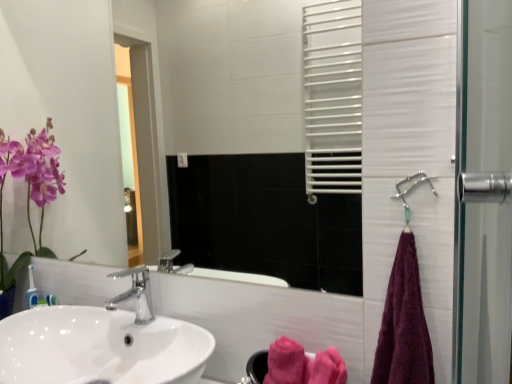
Describe the element at coordinates (247, 147) in the screenshot. The image size is (512, 384). I see `white glossy mirror at upper center` at that location.

The width and height of the screenshot is (512, 384). What are the coordinates of `purple cotton towel at right, which appears as the first bath towel when viewed from the right` in the screenshot? It's located at (404, 324).

Locate an element on the screen. polished chrome faucet at center is located at coordinates (135, 294).

Considering the points (225, 219) and (141, 367), which point is in front, point (225, 219) or point (141, 367)?

The point (141, 367) is more forward.

From the image's perspective, does white glossy mirror at upper center appear lower than white glossy sink at lower left?

No, from the image's perspective, white glossy mirror at upper center is not beneath white glossy sink at lower left.

Could white glossy sink at lower left be considered to be inside white glossy mirror at upper center?

No, white glossy sink at lower left is not surrounded by white glossy mirror at upper center.

In terms of size, does white glossy mirror at upper center appear bigger or smaller than white glossy sink at lower left?

white glossy mirror at upper center is smaller than white glossy sink at lower left.

Considering the sizes of white glossy sink at lower left and white glossy mirror at upper center in the image, is white glossy sink at lower left wider or thinner than white glossy mirror at upper center?

In the image, white glossy sink at lower left appears to be wider than white glossy mirror at upper center.

Is white glossy sink at lower left facing towards white glossy mirror at upper center?

No, white glossy sink at lower left is not turned towards white glossy mirror at upper center.

Considering the relative positions of white glossy sink at lower left and white glossy mirror at upper center in the image provided, is white glossy sink at lower left behind white glossy mirror at upper center?

No, it is in front of white glossy mirror at upper center.

Is pink fluffy bath towel at lower center, which is the first bath towel in left-to-right order, facing away from white glossy sink at lower left?

No.

Who is smaller, pink fluffy bath towel at lower center, which is the first bath towel in left-to-right order, or white glossy sink at lower left?

pink fluffy bath towel at lower center, which is the first bath towel in left-to-right order, is smaller.

Could you measure the distance between pink fluffy bath towel at lower center, the 1th bath towel when ordered from back to front, and white glossy sink at lower left?

A distance of 17.06 inches exists between pink fluffy bath towel at lower center, the 1th bath towel when ordered from back to front, and white glossy sink at lower left.

I want to click on sink that is on the left side of pink fluffy bath towel at lower center, positioned as the second bath towel in right-to-left order, so click(100, 346).

In the image, is white glossy sink at lower left positioned in front of or behind pink fluffy bath towel at lower center, positioned as the 2th bath towel in front-to-back order?

Visually, white glossy sink at lower left is located in front of pink fluffy bath towel at lower center, positioned as the 2th bath towel in front-to-back order.

Between white glossy sink at lower left and pink fluffy bath towel at lower center, positioned as the second bath towel in right-to-left order, which one has smaller width?

With smaller width is pink fluffy bath towel at lower center, positioned as the second bath towel in right-to-left order.

Which is nearer, (42, 349) or (269, 377)?

Clearly, point (42, 349) is more distant from the camera than point (269, 377).

Is white glossy sink at lower left at the left side of polished chrome faucet at center?

Yes, white glossy sink at lower left is to the left of polished chrome faucet at center.

The height and width of the screenshot is (384, 512). I want to click on sink below the polished chrome faucet at center (from the image's perspective), so click(100, 346).

From a real-world perspective, is white glossy sink at lower left physically located above or below polished chrome faucet at center?

Clearly, from a real-world perspective, white glossy sink at lower left is below polished chrome faucet at center.

Does point (191, 343) lie in front of point (145, 312)?

Yes.

Is metallic silver shower at right not close to pink fluffy bath towel at lower center, which is the first bath towel in left-to-right order?

metallic silver shower at right is actually quite close to pink fluffy bath towel at lower center, which is the first bath towel in left-to-right order.

Which is more to the right, metallic silver shower at right or pink fluffy bath towel at lower center, positioned as the 2th bath towel in front-to-back order?

Positioned to the right is metallic silver shower at right.

How many degrees apart are the facing directions of metallic silver shower at right and pink fluffy bath towel at lower center, the 1th bath towel when ordered from back to front?

There is a 2.1-degree angle between the facing directions of metallic silver shower at right and pink fluffy bath towel at lower center, the 1th bath towel when ordered from back to front.

From the image's perspective, starting from the white glossy sink at lower left, which bath towel is the 2nd one above? Please provide its 2D coordinates.

[(404, 324)]

From the image's perspective, is white glossy sink at lower left over purple cotton towel at right, which appears as the first bath towel when viewed from the right?

No, from the image's perspective, white glossy sink at lower left is not on top of purple cotton towel at right, which appears as the first bath towel when viewed from the right.

Is purple cotton towel at right, placed as the 1th bath towel when sorted from front to back, completely or partially inside white glossy sink at lower left?

Definitely not — purple cotton towel at right, placed as the 1th bath towel when sorted from front to back, is not inside white glossy sink at lower left.

In the scene shown: Who is more distant, white glossy sink at lower left or purple cotton towel at right, which appears as the first bath towel when viewed from the right?

purple cotton towel at right, which appears as the first bath towel when viewed from the right, is further away from the camera.

You are a GUI agent. You are given a task and a screenshot of the screen. Output one action in this format:
    pyautogui.click(x=<x>, y=<y>)
    Task: Click on the sink lying on the left of white glossy mirror at upper center
    
    Given the screenshot: What is the action you would take?
    click(x=100, y=346)

Find the location of a particular element. sink below the white glossy mirror at upper center (from a real-world perspective) is located at coordinates (100, 346).

When comparing their distances from white glossy sink at lower left, does metallic silver shower at right or white glossy mirror at upper center seem closer?

metallic silver shower at right is closer to white glossy sink at lower left.

Considering their positions, is metallic silver shower at right positioned closer to white glossy mirror at upper center than pink fluffy bath towel at lower center, positioned as the 2th bath towel in front-to-back order?

The object closer to white glossy mirror at upper center is pink fluffy bath towel at lower center, positioned as the 2th bath towel in front-to-back order.

Estimate the real-world distances between objects in this image. Which object is closer to pink fluffy bath towel at lower center, positioned as the 2th bath towel in front-to-back order, purple cotton towel at right, placed as the 1th bath towel when sorted from front to back, or metallic silver shower at right?

Based on the image, purple cotton towel at right, placed as the 1th bath towel when sorted from front to back, appears to be nearer to pink fluffy bath towel at lower center, positioned as the 2th bath towel in front-to-back order.

Estimate the real-world distances between objects in this image. Which object is further from white glossy mirror at upper center, purple cotton towel at right, which appears as the first bath towel when viewed from the right, or pink fluffy bath towel at lower center, positioned as the second bath towel in right-to-left order?

The object further to white glossy mirror at upper center is pink fluffy bath towel at lower center, positioned as the second bath towel in right-to-left order.

Looking at the image, which one is located closer to white glossy sink at lower left, purple cotton towel at right, placed as the second bath towel when sorted from back to front, or white glossy mirror at upper center?

purple cotton towel at right, placed as the second bath towel when sorted from back to front, is closer to white glossy sink at lower left.

Looking at this image, from the image, which object appears to be farther from white glossy mirror at upper center, pink fluffy bath towel at lower center, positioned as the 2th bath towel in front-to-back order, or purple cotton towel at right, placed as the 1th bath towel when sorted from front to back?

The object further to white glossy mirror at upper center is pink fluffy bath towel at lower center, positioned as the 2th bath towel in front-to-back order.

Which object lies nearer to the anchor point pink fluffy bath towel at lower center, positioned as the second bath towel in right-to-left order, white glossy mirror at upper center or metallic silver shower at right?

metallic silver shower at right lies closer to pink fluffy bath towel at lower center, positioned as the second bath towel in right-to-left order, than the other object.

When comparing their distances from white glossy mirror at upper center, does white glossy sink at lower left or purple cotton towel at right, which appears as the first bath towel when viewed from the right, seem closer?

Based on the image, white glossy sink at lower left appears to be nearer to white glossy mirror at upper center.

The width and height of the screenshot is (512, 384). In order to click on bath towel located between polished chrome faucet at center and purple cotton towel at right, placed as the second bath towel when sorted from back to front, in the left-right direction in this screenshot , I will do pos(287,363).

At what (x,y) coordinates should I click in order to perform the action: click on mirror between white glossy sink at lower left and metallic silver shower at right in the horizontal direction. Please return your answer as a coordinate pair (x, y). This screenshot has height=384, width=512. Looking at the image, I should click on (247, 147).

Locate an element on the screen. The width and height of the screenshot is (512, 384). bath towel between metallic silver shower at right and pink fluffy bath towel at lower center, positioned as the second bath towel in right-to-left order, vertically is located at coordinates (404, 324).

Where is `tap between white glossy sink at lower left and purple cotton towel at right, which is counted as the second bath towel, starting from the left`? Image resolution: width=512 pixels, height=384 pixels. tap between white glossy sink at lower left and purple cotton towel at right, which is counted as the second bath towel, starting from the left is located at coordinates (135, 294).